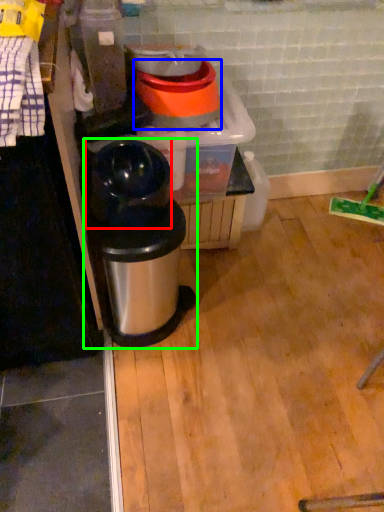
Question: Which object is positioned farthest from appliance (highlighted by a red box)? Select from appliance (highlighted by a blue box) and waste container (highlighted by a green box).

Choices:
 (A) appliance
 (B) waste container

Answer: (A)